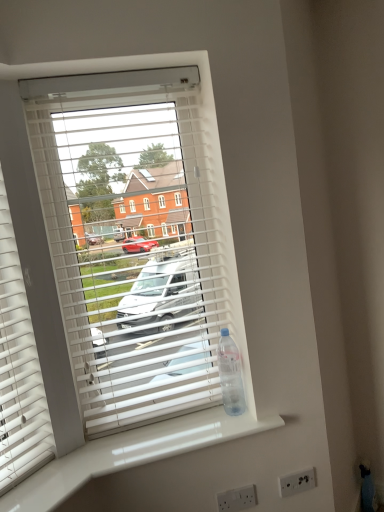
Where is `white plastic blinds at center`? The width and height of the screenshot is (384, 512). white plastic blinds at center is located at coordinates (133, 239).

What do you see at coordinates (237, 499) in the screenshot? This screenshot has height=512, width=384. I see `white plastic electric outlet at lower center, the first electric outlet when ordered from left to right` at bounding box center [237, 499].

The width and height of the screenshot is (384, 512). What do you see at coordinates (131, 454) in the screenshot?
I see `white glossy counter top at lower center` at bounding box center [131, 454].

This screenshot has width=384, height=512. What do you see at coordinates (230, 375) in the screenshot? I see `clear plastic bottle at right` at bounding box center [230, 375].

Where is `white plastic electric outlet at lower right, arranged as the 2th electric outlet when viewed from the left`? white plastic electric outlet at lower right, arranged as the 2th electric outlet when viewed from the left is located at coordinates (297, 482).

Do you think white plastic electric outlet at lower right, the 1th electric outlet from the back, is within clear plastic bottle at right, or outside of it?

white plastic electric outlet at lower right, the 1th electric outlet from the back, exists outside the volume of clear plastic bottle at right.

Which object is thinner, white plastic electric outlet at lower right, positioned as the 2th electric outlet in front-to-back order, or clear plastic bottle at right?

Thinner between the two is white plastic electric outlet at lower right, positioned as the 2th electric outlet in front-to-back order.

Can you confirm if white plastic electric outlet at lower right, the 1th electric outlet from the back, is bigger than clear plastic bottle at right?

No.

From the image's perspective, would you say white plastic electric outlet at lower right, the 1th electric outlet from the back, is shown under clear plastic bottle at right?

Yes, from the image's perspective, white plastic electric outlet at lower right, the 1th electric outlet from the back, is beneath clear plastic bottle at right.

Does white plastic blinds at center have a greater height compared to white plastic electric outlet at lower center, the first electric outlet when ordered from left to right?

Correct, white plastic blinds at center is much taller as white plastic electric outlet at lower center, the first electric outlet when ordered from left to right.

How distant is white plastic blinds at center from white plastic electric outlet at lower center, positioned as the 2th electric outlet in right-to-left order?

A distance of 93.63 centimeters exists between white plastic blinds at center and white plastic electric outlet at lower center, positioned as the 2th electric outlet in right-to-left order.

At what (x,y) coordinates should I click in order to perform the action: click on window blind above the white plastic electric outlet at lower center, which appears as the second electric outlet when viewed from the back (from a real-world perspective). Please return your answer as a coordinate pair (x, y). This screenshot has width=384, height=512. Looking at the image, I should click on (133, 239).

Is white plastic blinds at center completely or partially outside of white plastic electric outlet at lower center, which appears as the second electric outlet when viewed from the back?

Absolutely, white plastic blinds at center is external to white plastic electric outlet at lower center, which appears as the second electric outlet when viewed from the back.

Is white glossy counter top at lower center not close to white plastic electric outlet at lower center, the 1th electric outlet when ordered from front to back?

No, white glossy counter top at lower center is not far from white plastic electric outlet at lower center, the 1th electric outlet when ordered from front to back.

Considering the relative sizes of white glossy counter top at lower center and white plastic electric outlet at lower center, positioned as the 2th electric outlet in right-to-left order, in the image provided, is white glossy counter top at lower center thinner than white plastic electric outlet at lower center, positioned as the 2th electric outlet in right-to-left order,?

Incorrect, the width of white glossy counter top at lower center is not less than that of white plastic electric outlet at lower center, positioned as the 2th electric outlet in right-to-left order.

Is white glossy counter top at lower center further to camera compared to white plastic electric outlet at lower center, which appears as the second electric outlet when viewed from the back?

No, it is in front of white plastic electric outlet at lower center, which appears as the second electric outlet when viewed from the back.

From a real-world perspective, is white glossy counter top at lower center positioned above or below white plastic electric outlet at lower center, the first electric outlet when ordered from left to right?

white glossy counter top at lower center is situated higher than white plastic electric outlet at lower center, the first electric outlet when ordered from left to right, in the real world.

Does clear plastic bottle at right appear on the right side of white plastic blinds at center?

Yes, clear plastic bottle at right is to the right of white plastic blinds at center.

Locate an element on the screen. This screenshot has width=384, height=512. window blind on the left of clear plastic bottle at right is located at coordinates (133, 239).

Is clear plastic bottle at right outside of white plastic blinds at center?

Yes, clear plastic bottle at right is not within white plastic blinds at center.

Is white plastic electric outlet at lower center, the 1th electric outlet when ordered from front to back, spatially inside clear plastic bottle at right, or outside of it?

white plastic electric outlet at lower center, the 1th electric outlet when ordered from front to back, cannot be found inside clear plastic bottle at right.

Measure the distance from white plastic electric outlet at lower center, the first electric outlet when ordered from left to right, to clear plastic bottle at right.

15.10 inches.

Can you confirm if white plastic electric outlet at lower center, the 1th electric outlet when ordered from front to back, is shorter than clear plastic bottle at right?

Indeed, white plastic electric outlet at lower center, the 1th electric outlet when ordered from front to back, has a lesser height compared to clear plastic bottle at right.

Is point (302, 483) positioned after point (57, 168)?

That is True.

Would you consider white plastic electric outlet at lower right, arranged as the 2th electric outlet when viewed from the left, to be distant from white plastic blinds at center?

white plastic electric outlet at lower right, arranged as the 2th electric outlet when viewed from the left, is positioned a significant distance from white plastic blinds at center.

Could you tell me if white plastic electric outlet at lower right, arranged as the 2th electric outlet when viewed from the left, is turned towards white plastic blinds at center?

Answer: No, white plastic electric outlet at lower right, arranged as the 2th electric outlet when viewed from the left, does not turn towards white plastic blinds at center.

From the image's perspective, which is below, white plastic electric outlet at lower right, arranged as the 2th electric outlet when viewed from the left, or white plastic blinds at center?

white plastic electric outlet at lower right, arranged as the 2th electric outlet when viewed from the left, is shown below in the image.

Which of these two, white plastic electric outlet at lower center, positioned as the 2th electric outlet in right-to-left order, or white plastic blinds at center, is smaller?

white plastic electric outlet at lower center, positioned as the 2th electric outlet in right-to-left order.

Is white plastic electric outlet at lower center, positioned as the 2th electric outlet in right-to-left order, positioned in front of white plastic blinds at center?

No, white plastic electric outlet at lower center, positioned as the 2th electric outlet in right-to-left order, is further to the viewer.

Is white plastic electric outlet at lower center, positioned as the 2th electric outlet in right-to-left order, located outside white plastic blinds at center?

Yes, white plastic electric outlet at lower center, positioned as the 2th electric outlet in right-to-left order, is outside of white plastic blinds at center.

From the image's perspective, is white plastic electric outlet at lower center, positioned as the 2th electric outlet in right-to-left order, located above or below white plastic blinds at center?

From the image's perspective, white plastic electric outlet at lower center, positioned as the 2th electric outlet in right-to-left order, appears below white plastic blinds at center.

Image resolution: width=384 pixels, height=512 pixels. In order to click on bottle that is above the white plastic electric outlet at lower right, positioned as the 2th electric outlet in front-to-back order (from a real-world perspective) in this screenshot , I will do `click(230, 375)`.

This screenshot has width=384, height=512. What are the coordinates of `the 1st electric outlet to the right when counting from the white plastic blinds at center` in the screenshot? It's located at (237, 499).

Based on their spatial positions, is white plastic electric outlet at lower center, the 1th electric outlet when ordered from front to back, or white plastic electric outlet at lower right, the 1th electric outlet when ordered from right to left, further from white glossy counter top at lower center?

white plastic electric outlet at lower right, the 1th electric outlet when ordered from right to left, is positioned further to the anchor white glossy counter top at lower center.

Based on the photo, from the image, which object appears to be nearer to white plastic electric outlet at lower right, positioned as the 2th electric outlet in front-to-back order, clear plastic bottle at right or white glossy counter top at lower center?

clear plastic bottle at right.

Based on the photo, which object lies further to the anchor point white plastic electric outlet at lower right, the 1th electric outlet when ordered from right to left, white plastic blinds at center or white plastic electric outlet at lower center, which appears as the second electric outlet when viewed from the back?

Among the two, white plastic blinds at center is located further to white plastic electric outlet at lower right, the 1th electric outlet when ordered from right to left.

Which object lies further to the anchor point white plastic blinds at center, white plastic electric outlet at lower right, the 1th electric outlet when ordered from right to left, or white glossy counter top at lower center?

white plastic electric outlet at lower right, the 1th electric outlet when ordered from right to left, is further to white plastic blinds at center.

Based on their spatial positions, is white glossy counter top at lower center or clear plastic bottle at right further from white plastic electric outlet at lower center, the 1th electric outlet when ordered from front to back?

The object further to white plastic electric outlet at lower center, the 1th electric outlet when ordered from front to back, is white glossy counter top at lower center.

Which object lies nearer to the anchor point white plastic blinds at center, white plastic electric outlet at lower center, which appears as the second electric outlet when viewed from the back, or white plastic electric outlet at lower right, positioned as the 2th electric outlet in front-to-back order?

white plastic electric outlet at lower center, which appears as the second electric outlet when viewed from the back, is positioned closer to the anchor white plastic blinds at center.

From the image, which object appears to be nearer to white glossy counter top at lower center, clear plastic bottle at right or white plastic blinds at center?

clear plastic bottle at right is positioned closer to the anchor white glossy counter top at lower center.

Which object lies nearer to the anchor point white plastic electric outlet at lower center, positioned as the 2th electric outlet in right-to-left order, white plastic blinds at center or clear plastic bottle at right?

Among the two, clear plastic bottle at right is located nearer to white plastic electric outlet at lower center, positioned as the 2th electric outlet in right-to-left order.

I want to click on bottle between white plastic blinds at center and white plastic electric outlet at lower center, the 1th electric outlet when ordered from front to back, in the vertical direction, so click(230, 375).

You are a GUI agent. You are given a task and a screenshot of the screen. Output one action in this format:
    pyautogui.click(x=<x>, y=<y>)
    Task: Click on the bottle between white glossy counter top at lower center and white plastic electric outlet at lower right, the 1th electric outlet when ordered from right to left
    
    Given the screenshot: What is the action you would take?
    pyautogui.click(x=230, y=375)

At what (x,y) coordinates should I click in order to perform the action: click on bottle between white plastic blinds at center and white plastic electric outlet at lower right, positioned as the 2th electric outlet in front-to-back order, from top to bottom. Please return your answer as a coordinate pair (x, y). This screenshot has width=384, height=512. Looking at the image, I should click on (230, 375).

This screenshot has height=512, width=384. What are the coordinates of `electric outlet between clear plastic bottle at right and white plastic electric outlet at lower center, the 1th electric outlet when ordered from front to back, from top to bottom` in the screenshot? It's located at (297, 482).